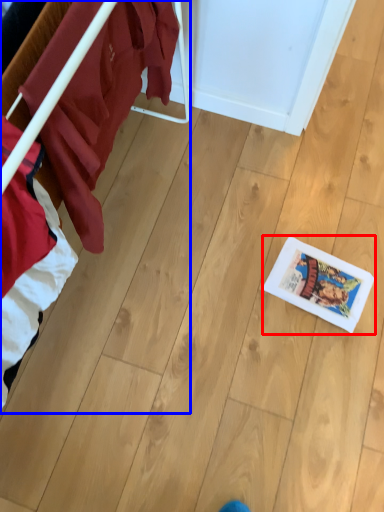
Question: Which object is further to the camera taking this photo, comic book (highlighted by a red box) or furniture (highlighted by a blue box)?

Choices:
 (A) comic book
 (B) furniture

Answer: (A)